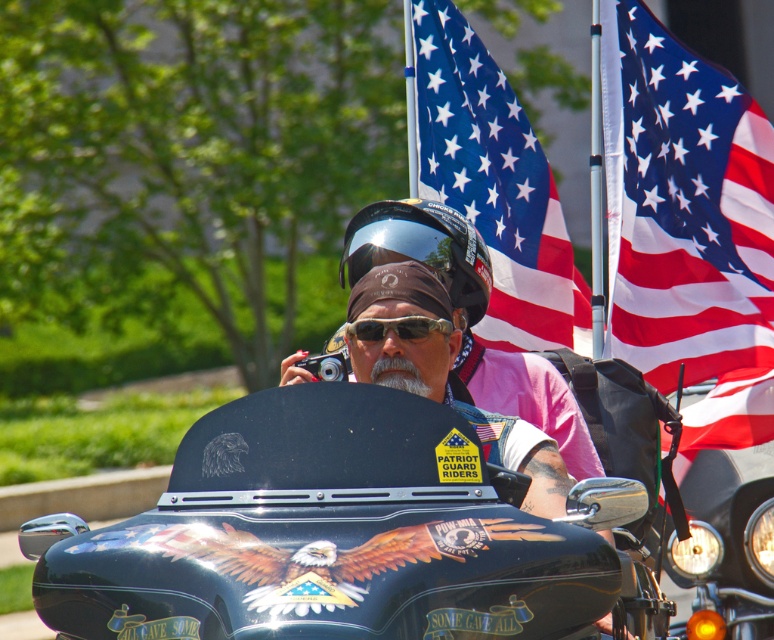
You are a photographer trying to capture a clear photo of the glossy black motorcycle at center and the glossy black helmet at center. Since you want the motorcycle to be the main focus, which object should you zoom in on more to ensure it appears larger in the photo?

The glossy black motorcycle at center is larger than the glossy black helmet at center, so you should zoom in more on the glossy black motorcycle at center to make it the main focus.

Please look at the image. There is a point at coordinate (341,534). What object is this point located on?

The point at coordinate (341,534) is located on the glossy black motorcycle at center.

You are standing at the point marked by the coordinates point at (659,172). You want to see the motorcycle with patriotic decorations in the scene. Is the motorcycle within your line of sight?

The point at (659,172) is 130.30 feet away from the viewer. Since the motorcycle is part of the scene described, it is likely within the viewer s line of sight unless obstructed, but the distance might make details hard to discern.